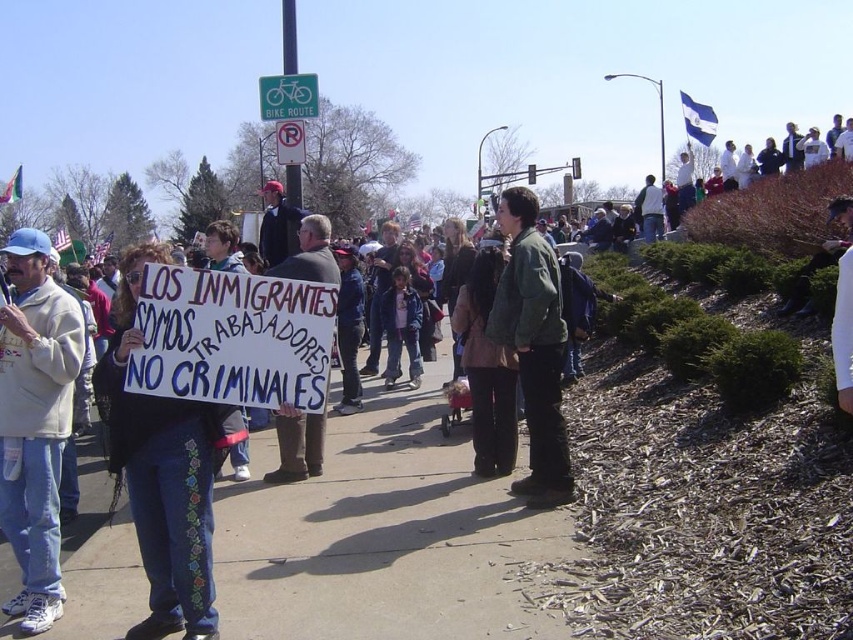
Is point (498, 316) more distant than point (283, 106)?

No, it is in front of (283, 106).

Find the location of `green fuzzy jacket at center`. green fuzzy jacket at center is located at coordinates (532, 346).

Between point (73, 330) and point (303, 92), which one is positioned behind?

Point (303, 92)

What do you see at coordinates (35, 420) in the screenshot?
I see `white fleece sweatshirt at center` at bounding box center [35, 420].

At what (x,y) coordinates should I click in order to perform the action: click on white fleece sweatshirt at center. Please return your answer as a coordinate pair (x, y). Looking at the image, I should click on (35, 420).

Between green fuzzy jacket at center and white paper sign at center, which one appears on the left side from the viewer's perspective?

Positioned to the left is white paper sign at center.

Who is positioned more to the right, green fuzzy jacket at center or white paper sign at center?

From the viewer's perspective, green fuzzy jacket at center appears more on the right side.

The width and height of the screenshot is (853, 640). In order to click on green fuzzy jacket at center in this screenshot , I will do `click(532, 346)`.

Identify the location of green fuzzy jacket at center. This screenshot has height=640, width=853. (532, 346).